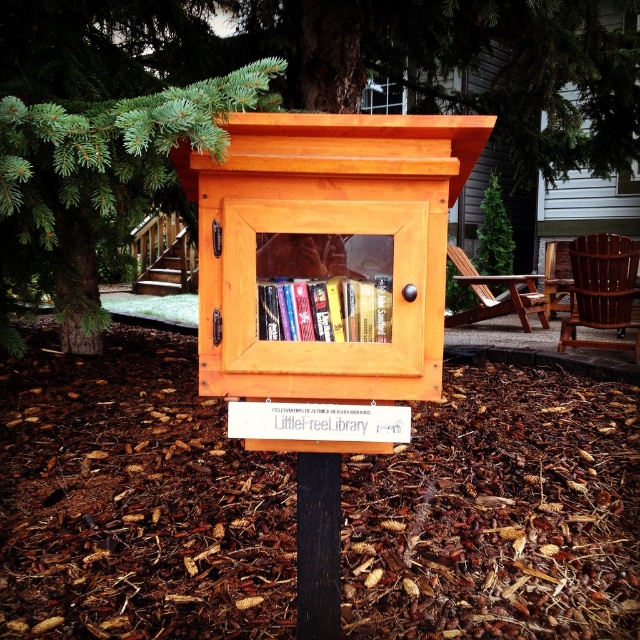
Question: Among these points, which one is farthest from the camera?

Choices:
 (A) (312, 323)
 (B) (328, 493)

Answer: (B)

Question: Which point is closer to the camera?

Choices:
 (A) (22, 140)
 (B) (324, 529)

Answer: (A)

Question: Observing the image, what is the correct spatial positioning of green pine tree at upper center in reference to black wood post at center?

Choices:
 (A) left
 (B) right

Answer: (B)

Question: Which object is the farthest from the green pine tree at upper center?

Choices:
 (A) black wood post at center
 (B) hardcover books at center

Answer: (A)

Question: Can you confirm if green pine tree at upper center is bigger than black wood post at center?

Choices:
 (A) no
 (B) yes

Answer: (B)

Question: Can you confirm if hardcover books at center is positioned to the right of black wood post at center?

Choices:
 (A) no
 (B) yes

Answer: (B)